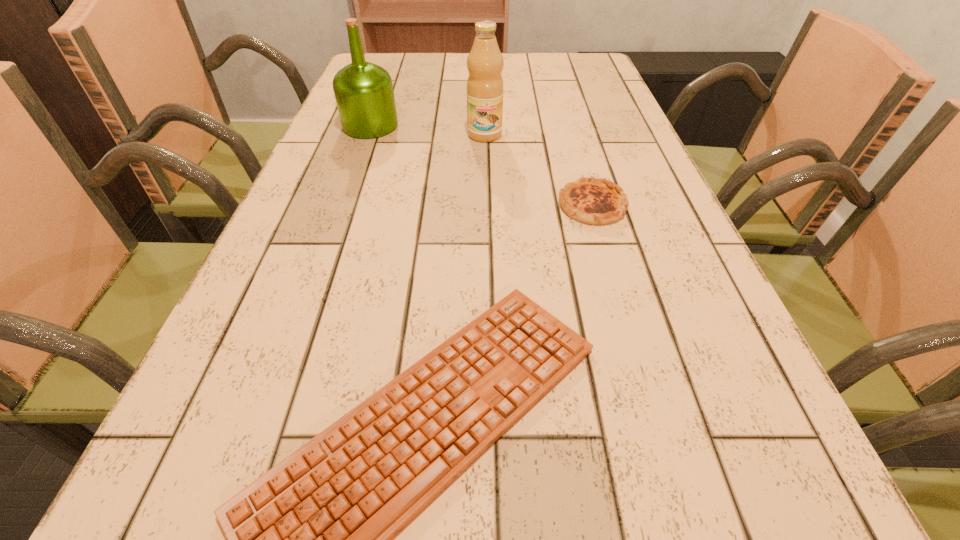
Locate which object is the third closest to the right olive oil. Please provide its 2D coordinates. Your answer should be formatted as a tuple, i.e. [(x, y)], where the tuple contains the x and y coordinates of a point satisfying the conditions above.

[(311, 539)]

Identify the location of the third closest object to the right olive oil. The image size is (960, 540). (311, 539).

I want to click on vacant space that satisfies the following two spatial constraints: 1. on the label of the right olive oil; 2. on the right side of the quiche, so click(486, 205).

Find the location of a particular element. The width and height of the screenshot is (960, 540). free location that satisfies the following two spatial constraints: 1. on the label of the second nearest object; 2. on the left side of the right olive oil is located at coordinates (486, 205).

In order to click on vacant region that satisfies the following two spatial constraints: 1. on the front side of the left olive oil; 2. on the left side of the second shortest object in this screenshot , I will do `click(342, 205)`.